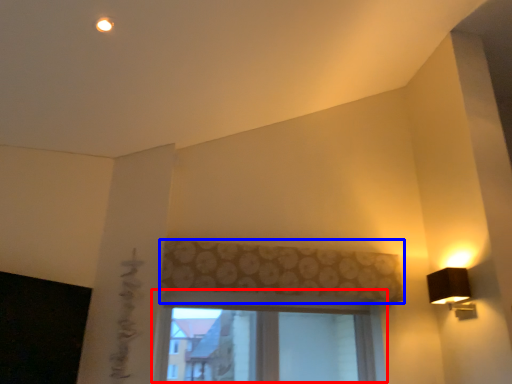
Question: Which object appears farthest to the camera in this image, window (highlighted by a red box) or curtain (highlighted by a blue box)?

Choices:
 (A) window
 (B) curtain

Answer: (A)